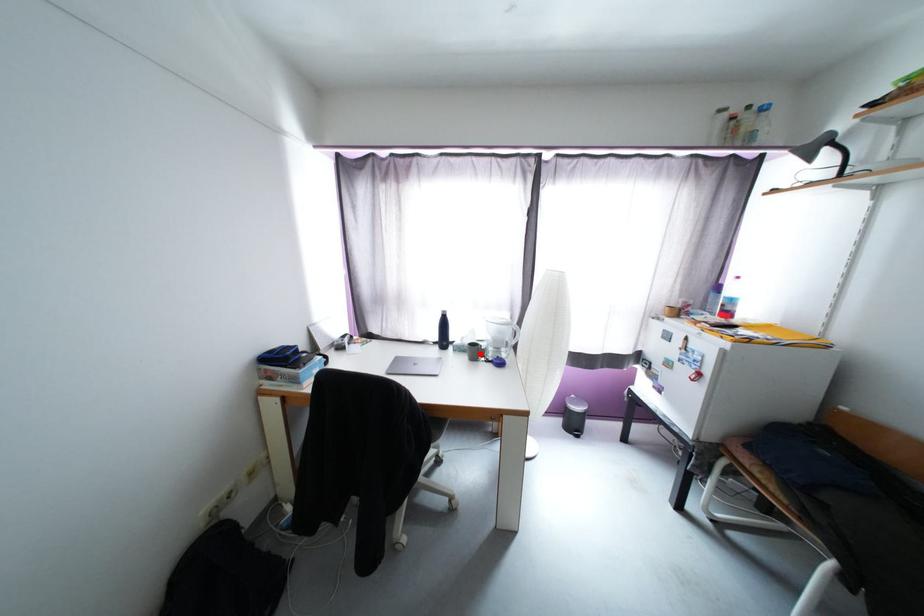
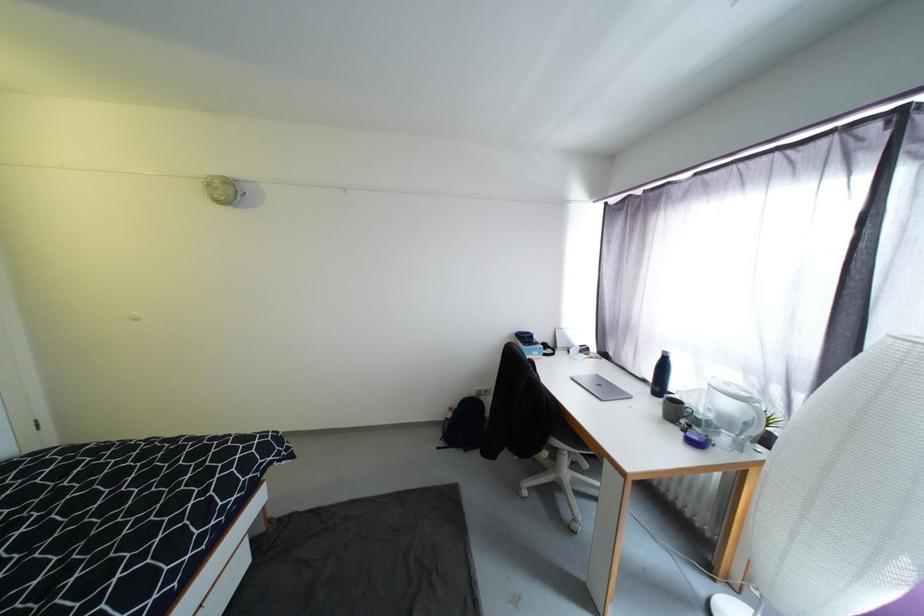
The point at the highlighted location is marked in the first image. Where is the corresponding point in the second image?

(683, 413)